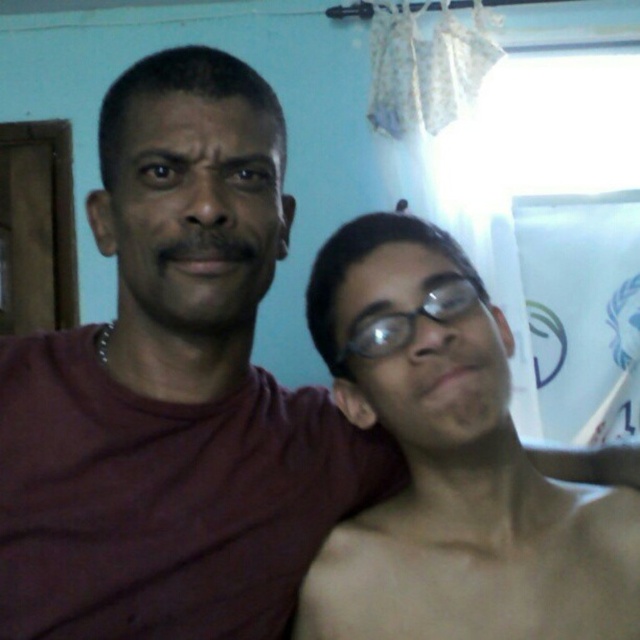
You are a photographer setting up a photo shoot in this room. You need to place a 10 cm tall object between the shiny black glasses at right and the black plastic glasses at center. Can you fit it vertically without overlapping either?

The shiny black glasses at right is taller than the black plastic glasses at center. Since the object is 10 cm tall, and the vertical space between them depends on their height difference, but the description only mentions height comparison, not the actual vertical distance between them. Therefore, it is unclear if there is enough vertical space to place the object without overlapping.

You are a photographer setting up a shoot in this room. You need to position a light source so that it illuminates both the shiny black glasses at right and the black plastic glasses at center without casting harsh shadows. Given their positions, where should you place the light source relative to the glasses?

The shiny black glasses at right is below the black plastic glasses at center, so placing the light source above and between them would evenly illuminate both without harsh shadows.

You are a photographer setting up a shot of the two people in the scene. You need to focus on the shiny black glasses at right and the black plastic glasses at center. Which pair of glasses should you adjust your camera focus for first if you want to ensure both are in focus?

You should focus on the shiny black glasses at right first because it is closer to the viewer than the black plastic glasses at center. By focusing on the closer object, the depth of field may naturally include the farther object in acceptable focus.